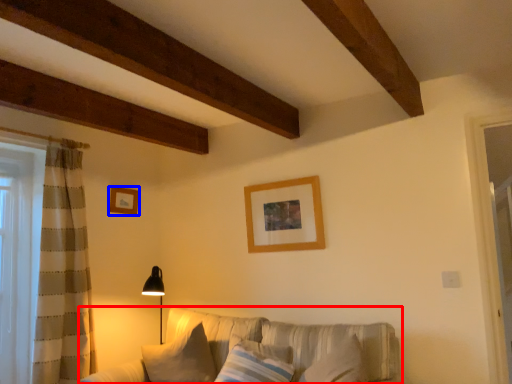
Question: Which of the following is the closest to the observer, studio couch (highlighted by a red box) or picture frame (highlighted by a blue box)?

Choices:
 (A) studio couch
 (B) picture frame

Answer: (A)